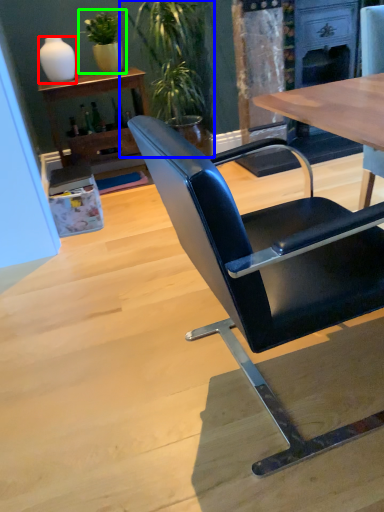
Question: Estimate the real-world distances between objects in this image. Which object is closer to vase (highlighted by a red box), houseplant (highlighted by a blue box) or houseplant (highlighted by a green box)?

Choices:
 (A) houseplant
 (B) houseplant

Answer: (B)